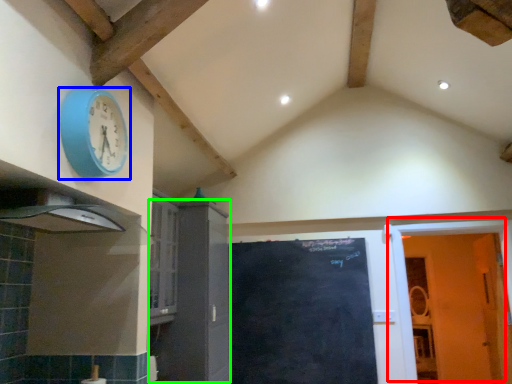
Question: Estimate the real-world distances between objects in this image. Which object is closer to door (highlighted by a red box), wall clock (highlighted by a blue box) or cabinetry (highlighted by a green box)?

Choices:
 (A) wall clock
 (B) cabinetry

Answer: (B)